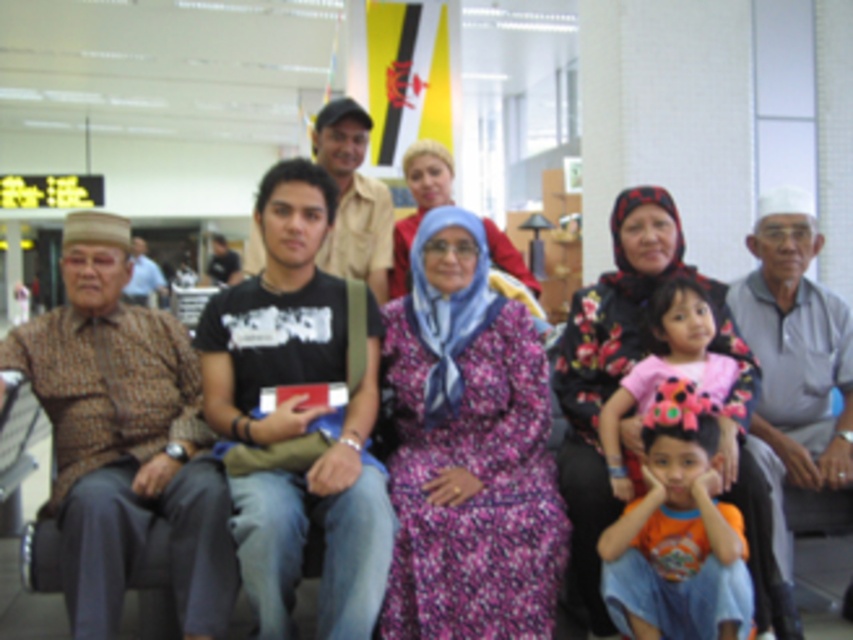
Question: Which of the following is the closest to the observer?

Choices:
 (A) purple floral dress at center
 (B) orange cotton shirt at lower right
 (C) floral fabric dress at center
 (D) floral-patterned dress at center

Answer: (B)

Question: Which object appears closest to the camera in this image?

Choices:
 (A) orange cotton shirt at lower right
 (B) purple floral dress at center
 (C) pink fabric dress at center
 (D) floral-patterned dress at center

Answer: (A)

Question: Observing the image, what is the correct spatial positioning of pink fabric dress at center in reference to purple floral dress at center?

Choices:
 (A) right
 (B) left

Answer: (A)

Question: Is floral fabric dress at center below pink fabric dress at center?

Choices:
 (A) yes
 (B) no

Answer: (A)

Question: Which object is positioned closest to the purple floral dress at center?

Choices:
 (A) pink fabric dress at center
 (B) floral-patterned dress at center
 (C) floral fabric dress at center

Answer: (B)

Question: Does floral-patterned dress at center appear under pink fabric dress at center?

Choices:
 (A) no
 (B) yes

Answer: (B)